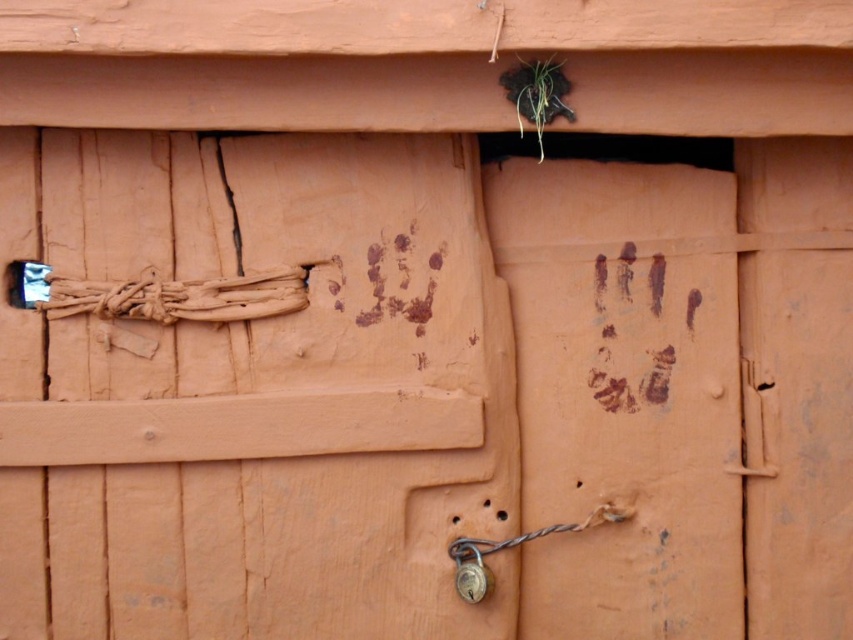
Can you confirm if brass metallic padlock at bottom center is positioned to the right of metallic padlock at center?

Correct, you'll find brass metallic padlock at bottom center to the right of metallic padlock at center.

Which is below, brass metallic padlock at bottom center or metallic padlock at center?

metallic padlock at center

What do you see at coordinates (511, 547) in the screenshot?
I see `brass metallic padlock at bottom center` at bounding box center [511, 547].

The height and width of the screenshot is (640, 853). In order to click on brass metallic padlock at bottom center in this screenshot , I will do `click(511, 547)`.

Who is shorter, wooden door handle at right or metallic padlock at center?

Standing shorter between the two is metallic padlock at center.

Is wooden door handle at right further to the viewer compared to metallic padlock at center?

Yes, wooden door handle at right is behind metallic padlock at center.

Looking at this image, who is more distant from viewer, [749,404] or [463,586]?

Positioned behind is point [749,404].

Find the location of `wooden door handle at right`. wooden door handle at right is located at coordinates (752, 428).

Can you confirm if brown rope at left is bigger than brass metallic padlock at bottom center?

No.

Does brown rope at left lie in front of brass metallic padlock at bottom center?

No, it is behind brass metallic padlock at bottom center.

Find the location of `brown rope at left`. brown rope at left is located at coordinates (164, 296).